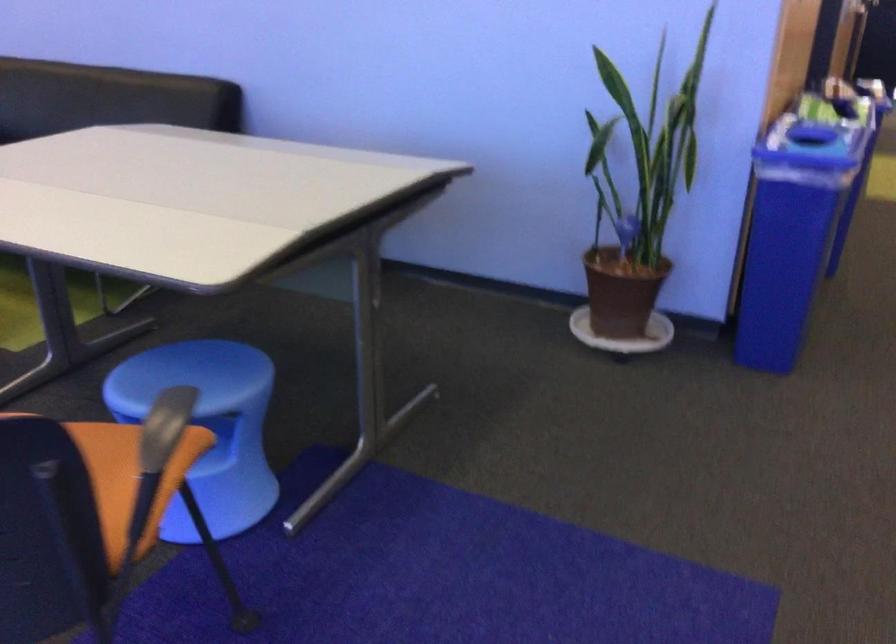
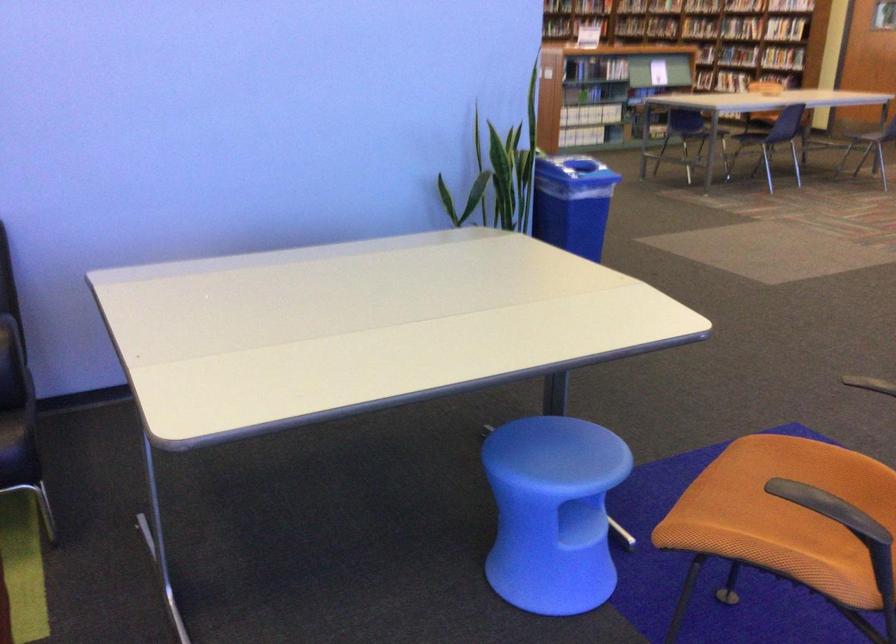
Find the pixel in the second image that matches (191,379) in the first image.

(560, 453)